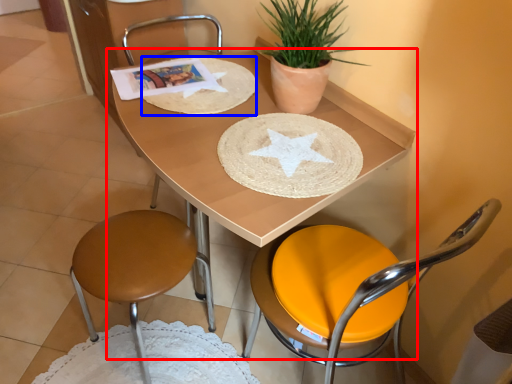
Question: Which point is closer to the camera, table (highlighted by a red box) or paper plate (highlighted by a blue box)?

Choices:
 (A) table
 (B) paper plate

Answer: (A)